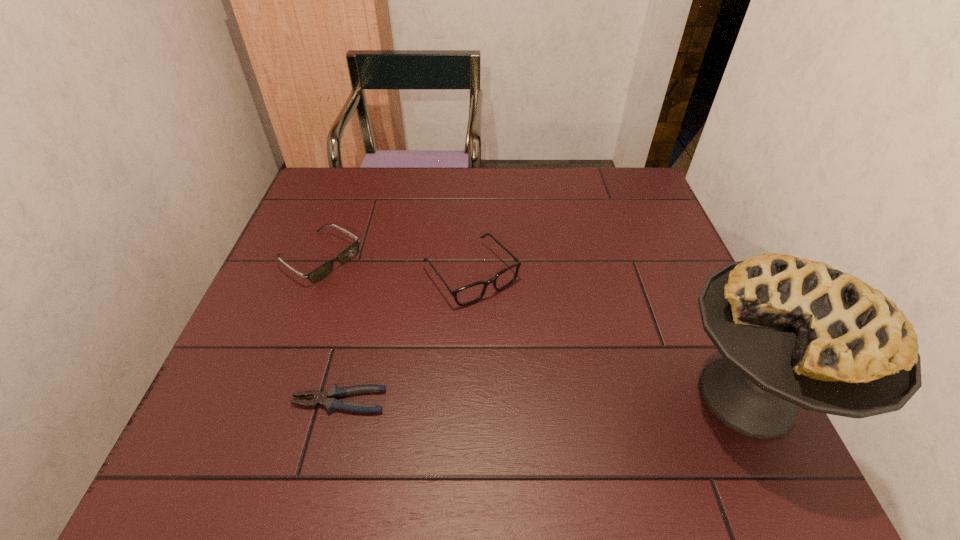
At what (x,y) coordinates should I click in order to perform the action: click on sunglasses that is at the left edge. Please return your answer as a coordinate pair (x, y). Looking at the image, I should click on (323, 270).

The width and height of the screenshot is (960, 540). In order to click on object that is at the right edge in this screenshot , I will do `click(792, 332)`.

In order to click on object that is at the near left corner in this screenshot , I will do `click(328, 399)`.

I want to click on object that is at the near right corner, so click(x=792, y=332).

In the image, there is a desktop. Where is `free space at the far edge`? free space at the far edge is located at coordinates (452, 188).

This screenshot has height=540, width=960. In the image, there is a desktop. Find the location of `vacant space at the near edge`. vacant space at the near edge is located at coordinates (551, 421).

The image size is (960, 540). Find the location of `vacant space at the left edge of the desktop`. vacant space at the left edge of the desktop is located at coordinates (346, 215).

The width and height of the screenshot is (960, 540). Identify the location of vacant area at the right edge. (684, 330).

This screenshot has height=540, width=960. I want to click on vacant space at the far left corner of the desktop, so click(311, 187).

In the image, there is a desktop. Where is `vacant space at the far right corner`? This screenshot has height=540, width=960. vacant space at the far right corner is located at coordinates click(606, 191).